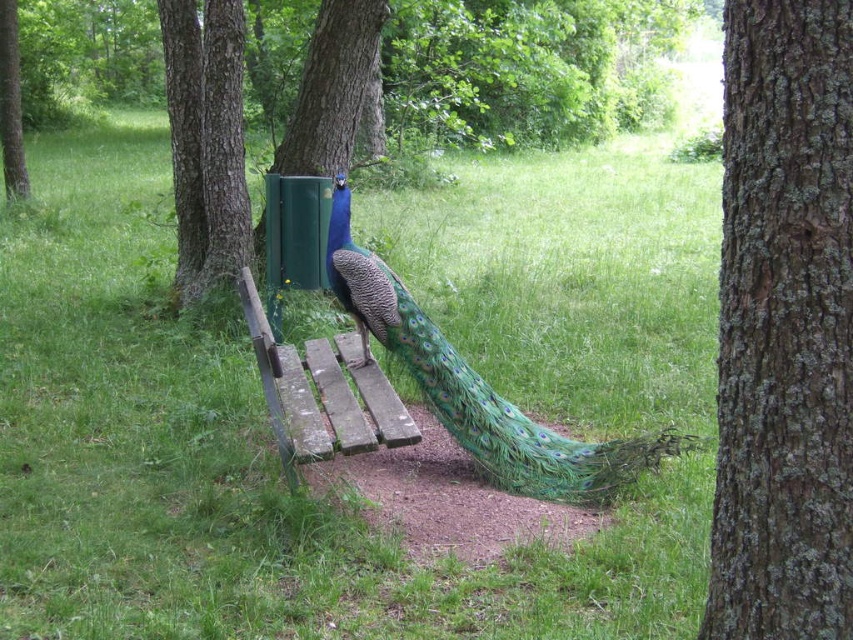
Question: Estimate the real-world distances between objects in this image. Which object is farther from the green bark tree at center?

Choices:
 (A) green textured box at upper center
 (B) green bark tree at left
 (C) rough bark tree at center

Answer: (B)

Question: Is weathered wood bench at center further to camera compared to green textured box at upper center?

Choices:
 (A) no
 (B) yes

Answer: (A)

Question: Can you confirm if rough bark tree at center is positioned to the left of weathered wood bench at center?

Choices:
 (A) no
 (B) yes

Answer: (A)

Question: Which point is farther from the camera taking this photo?

Choices:
 (A) (247, 289)
 (B) (549, 476)
 (C) (9, 140)
 (D) (190, 132)

Answer: (C)

Question: Among these objects, which one is nearest to the camera?

Choices:
 (A) green bark tree at center
 (B) green bark tree at left
 (C) green grass at center
 (D) green textured box at upper center

Answer: (C)

Question: Observing the image, what is the correct spatial positioning of rough bark tree at center in reference to green bark tree at left?

Choices:
 (A) above
 (B) below

Answer: (B)